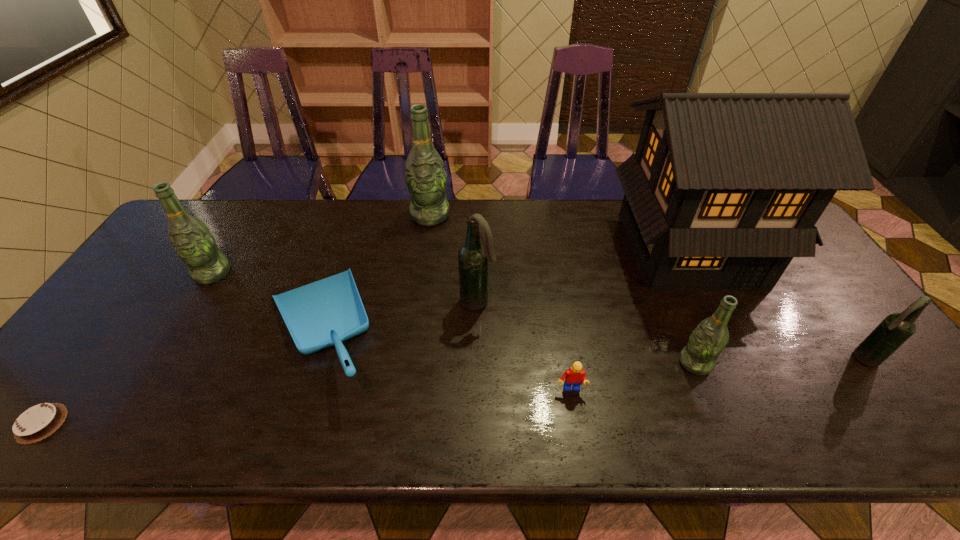
Where is `object that is at the near edge`? Image resolution: width=960 pixels, height=540 pixels. object that is at the near edge is located at coordinates (36, 423).

Image resolution: width=960 pixels, height=540 pixels. Identify the location of object at the left edge. (36, 423).

At what (x,y) coordinates should I click in order to perform the action: click on dollhouse situated at the right edge. Please return your answer as a coordinate pair (x, y). The height and width of the screenshot is (540, 960). Looking at the image, I should click on [724, 190].

Where is `beer bottle located in the right edge section of the desktop`? The image size is (960, 540). beer bottle located in the right edge section of the desktop is located at coordinates (896, 328).

This screenshot has width=960, height=540. Identify the location of object at the near left corner. (36, 423).

This screenshot has width=960, height=540. Find the location of `object that is at the far right corner`. object that is at the far right corner is located at coordinates (724, 190).

Identify the location of free region at the far edge of the desktop. Image resolution: width=960 pixels, height=540 pixels. (492, 227).

The image size is (960, 540). In the image, there is a desktop. Identify the location of vacant space at the near edge. (767, 424).

In the image, there is a desktop. At what (x,y) coordinates should I click in order to perform the action: click on vacant space at the left edge. Please return your answer as a coordinate pair (x, y). This screenshot has width=960, height=540. Looking at the image, I should click on (136, 272).

In the image, there is a desktop. At what (x,y) coordinates should I click in order to perform the action: click on free space at the right edge. Please return your answer as a coordinate pair (x, y). Looking at the image, I should click on (874, 375).